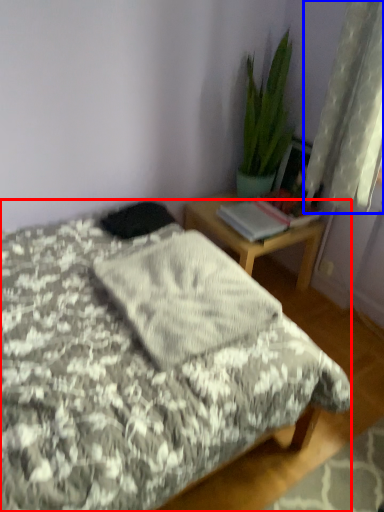
Question: Among these objects, which one is farthest to the camera, bed (highlighted by a red box) or curtain (highlighted by a blue box)?

Choices:
 (A) bed
 (B) curtain

Answer: (B)